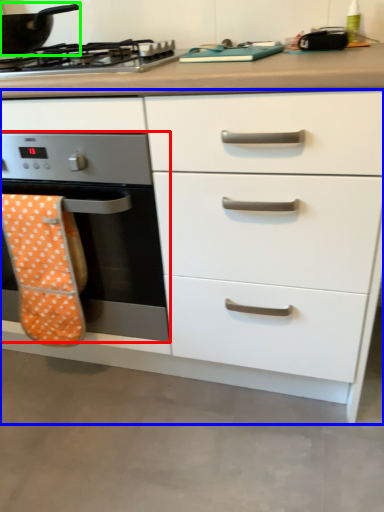
Question: Estimate the real-world distances between objects in this image. Which object is farther from home appliance (highlighted by a red box), chest of drawers (highlighted by a blue box) or kitchen appliance (highlighted by a green box)?

Choices:
 (A) chest of drawers
 (B) kitchen appliance

Answer: (B)